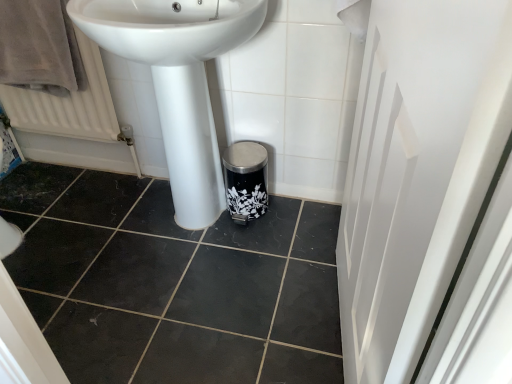
Question: Can you confirm if white glossy screen door at right is thinner than white glossy sink at center?

Choices:
 (A) yes
 (B) no

Answer: (A)

Question: Considering the relative sizes of white glossy screen door at right and white glossy sink at center in the image provided, is white glossy screen door at right bigger than white glossy sink at center?

Choices:
 (A) yes
 (B) no

Answer: (B)

Question: From the image's perspective, is white glossy screen door at right below white glossy sink at center?

Choices:
 (A) no
 (B) yes

Answer: (B)

Question: Considering the relative sizes of white glossy screen door at right and white glossy sink at center in the image provided, is white glossy screen door at right taller than white glossy sink at center?

Choices:
 (A) no
 (B) yes

Answer: (B)

Question: Is white glossy sink at center located within white glossy screen door at right?

Choices:
 (A) no
 (B) yes

Answer: (A)

Question: From a real-world perspective, is white textured radiator at left positioned above or below white glossy sink at center?

Choices:
 (A) above
 (B) below

Answer: (B)

Question: Considering the positions of white textured radiator at left and white glossy sink at center in the image, is white textured radiator at left taller or shorter than white glossy sink at center?

Choices:
 (A) short
 (B) tall

Answer: (A)

Question: Looking at their shapes, would you say white textured radiator at left is wider or thinner than white glossy sink at center?

Choices:
 (A) wide
 (B) thin

Answer: (B)

Question: Choose the correct answer: Is white textured radiator at left inside white glossy sink at center or outside it?

Choices:
 (A) outside
 (B) inside

Answer: (A)

Question: Considering the positions of point (97, 51) and point (64, 39), is point (97, 51) closer or farther from the camera than point (64, 39)?

Choices:
 (A) farther
 (B) closer

Answer: (A)

Question: From the image's perspective, is white textured radiator at left located above or below brown velvety bath towel at upper left?

Choices:
 (A) above
 (B) below

Answer: (B)

Question: Is white textured radiator at left inside the boundaries of brown velvety bath towel at upper left, or outside?

Choices:
 (A) inside
 (B) outside

Answer: (B)

Question: Looking at their shapes, would you say white textured radiator at left is wider or thinner than brown velvety bath towel at upper left?

Choices:
 (A) thin
 (B) wide

Answer: (A)

Question: Is white glossy sink at center inside the boundaries of white glossy screen door at right, or outside?

Choices:
 (A) inside
 (B) outside

Answer: (B)

Question: Does point (210, 177) appear closer or farther from the camera than point (359, 198)?

Choices:
 (A) farther
 (B) closer

Answer: (A)